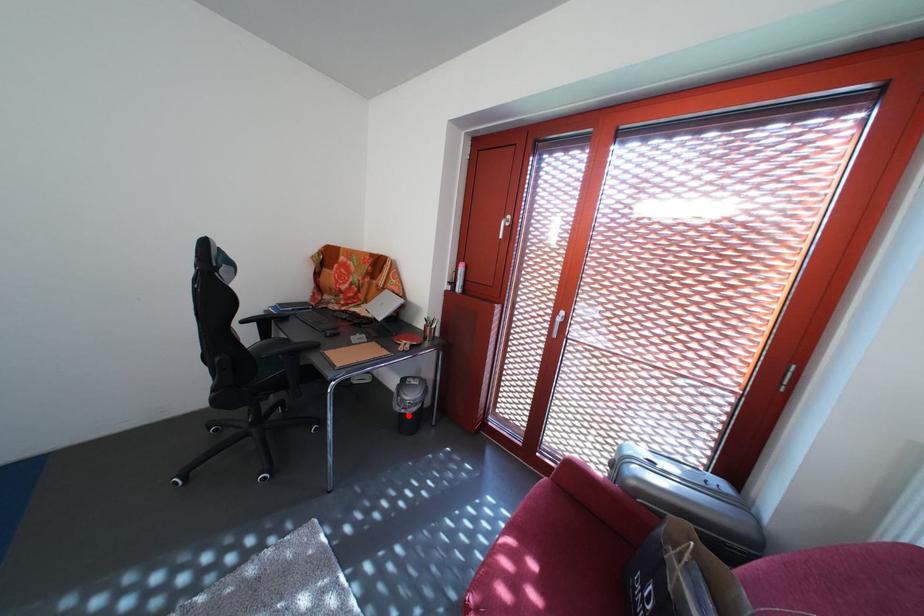
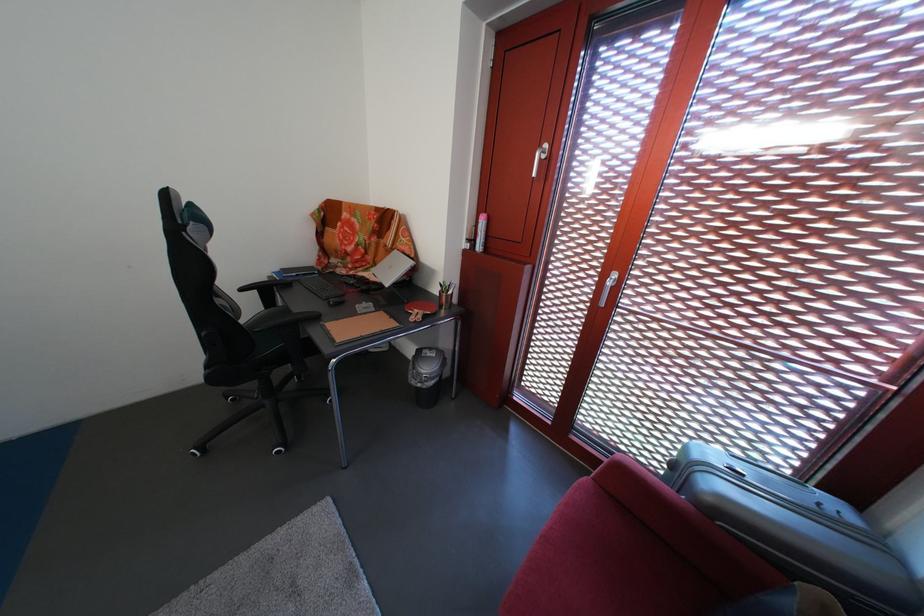
Find the pixel in the second image that matches the highlighted location in the first image.

(424, 389)